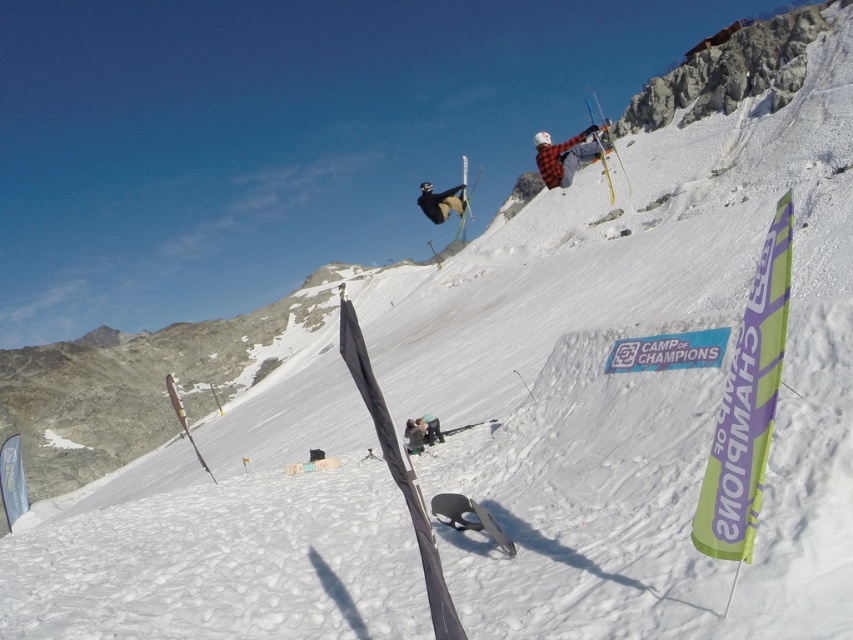
You are standing at the point labeled point (440, 202) in the image. Looking around, you see a black matte snowboarder at upper center. Which direction should you face to see the black matte snowboarder at upper center?

You are already at the point labeled point (440, 202), which is on the black matte snowboarder at upper center, so you are facing the snowboarder directly.